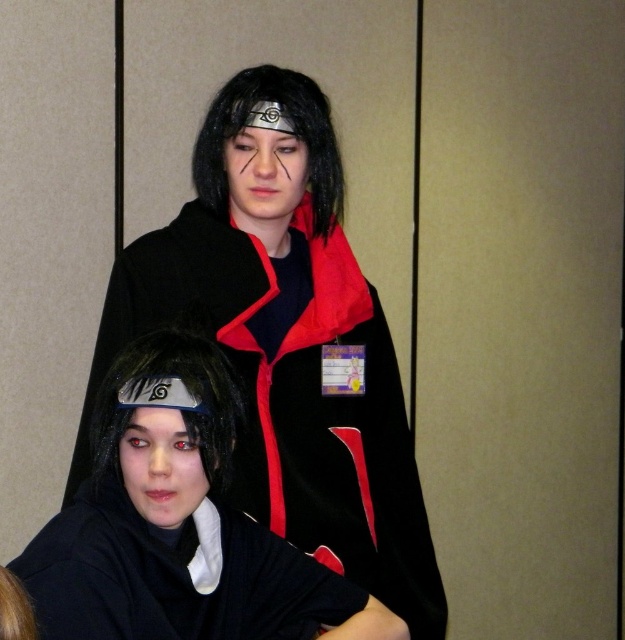
Question: Which point is closer to the camera?

Choices:
 (A) velvet black cape at upper center
 (B) brown matte wig at lower left
 (C) black matte wig at upper center

Answer: (B)

Question: Can you confirm if velvet black cape at upper center is positioned above black velvet robe at lower center?

Choices:
 (A) no
 (B) yes

Answer: (B)

Question: Which of these objects is positioned closest to the black matte wig at upper center?

Choices:
 (A) black velvet robe at lower center
 (B) velvet black cape at upper center

Answer: (B)

Question: Does velvet black cape at upper center have a greater width compared to slick black wig at lower center?

Choices:
 (A) no
 (B) yes

Answer: (B)

Question: Is black matte wig at lower center wider than slick black wig at lower center?

Choices:
 (A) no
 (B) yes

Answer: (B)

Question: Based on their relative distances, which object is farther from the brown matte wig at lower left?

Choices:
 (A) black matte wig at lower center
 (B) black matte wig at upper center
 (C) black velvet robe at lower center

Answer: (B)